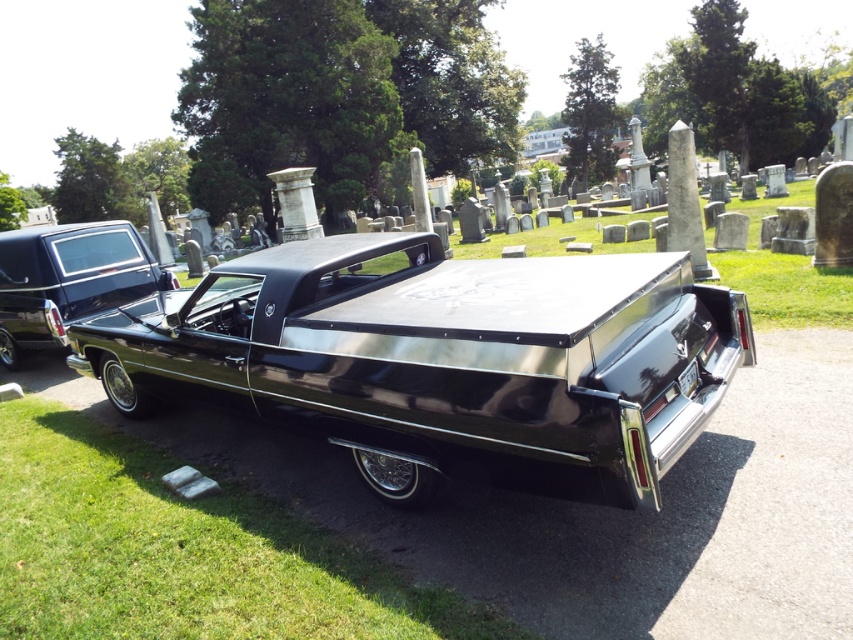
In the scene shown: You are a parking attendant at a cemetery and need to ensure there is enough space between the two glossy black cars. The minimum required distance between parked vehicles here is 5 meters. Based on the image, do the glossy black car at center and glossy black car at left meet this requirement?

The glossy black car at center and glossy black car at left are 5.16 meters apart, which exceeds the minimum required distance of 5 meters. Therefore, they meet the requirement.

You are standing at the edge of the cemetery looking at the scene. You see the glossy black car at center and the green grass at lower left. Which object is positioned higher in the image?

The glossy black car at center is positioned higher than the green grass at lower left in the image.

You are standing at the cemetery and want to take a photo of both vehicles. Which point, point (612, 387) or point (131, 291), is closer to your camera position?

Point (612, 387) is closer to the camera than point (131, 291).